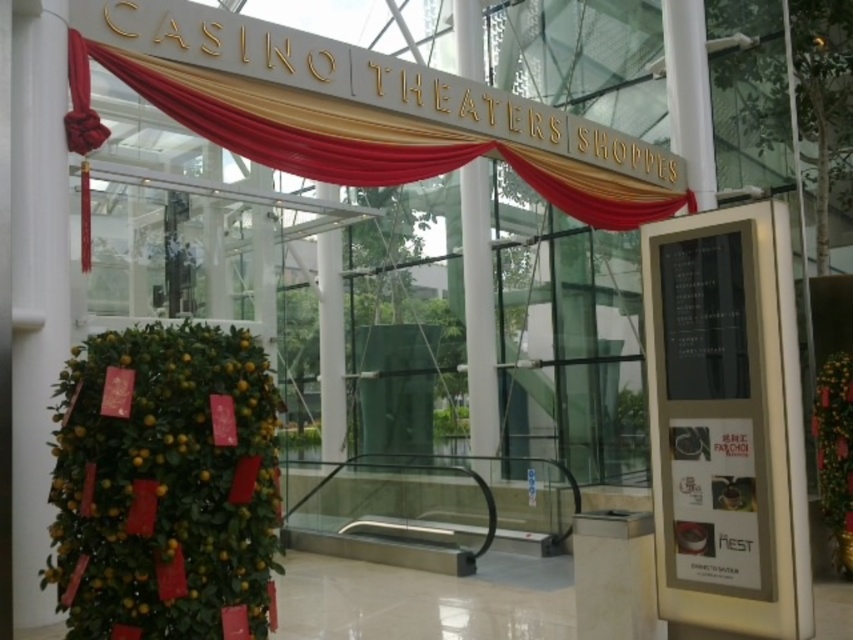
You are standing at the entrance of the building and want to read the metallic gold sign at right. Is the sign closer to you than the gold satin curtain at upper center?

Yes, the metallic gold sign at right is closer to the viewer than the gold satin curtain at upper center according to the description.

Based on the photo, you are designing a layout for a new exhibition and want to place a large banner between the metallic gold sign at right and the gold satin curtain at upper center. Based on their sizes, which object should the banner be placed closer to?

The metallic gold sign at right is smaller than the gold satin curtain at upper center, so the banner should be placed closer to the gold satin curtain at upper center to maintain visual balance.